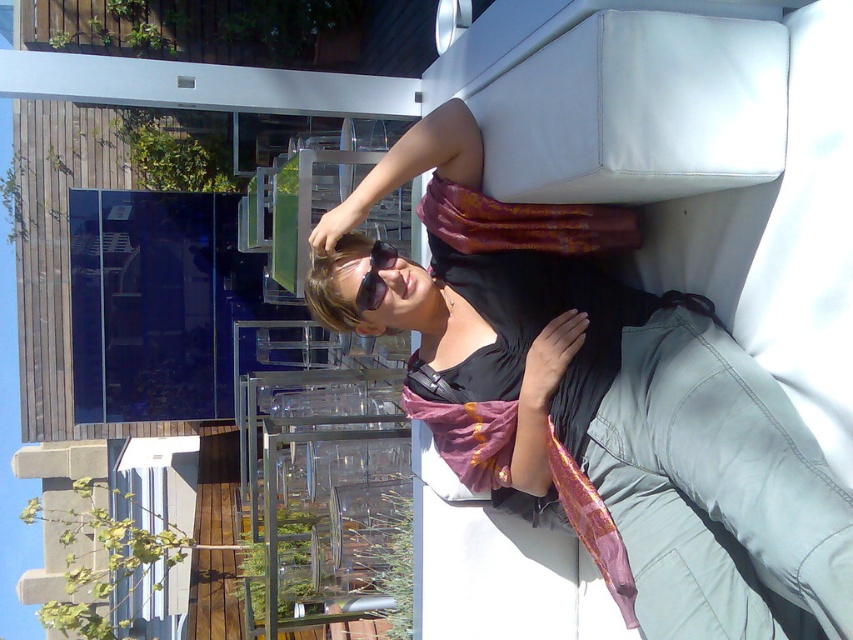
Question: Which of the following is the farthest from the observer?

Choices:
 (A) black plastic goggles at upper center
 (B) matte black scarf at center

Answer: (A)

Question: Observing the image, what is the correct spatial positioning of matte black scarf at center in reference to black plastic goggles at upper center?

Choices:
 (A) left
 (B) right

Answer: (B)

Question: Does matte black scarf at center appear under black plastic goggles at upper center?

Choices:
 (A) yes
 (B) no

Answer: (A)

Question: Can you confirm if matte black scarf at center is positioned to the right of black plastic goggles at upper center?

Choices:
 (A) no
 (B) yes

Answer: (B)

Question: Among these objects, which one is nearest to the camera?

Choices:
 (A) matte black scarf at center
 (B) black plastic goggles at upper center

Answer: (A)